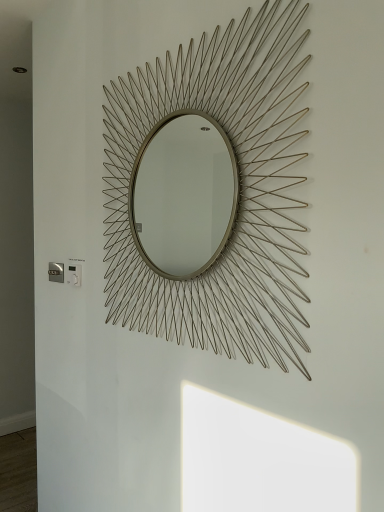
The image size is (384, 512). What do you see at coordinates (56, 272) in the screenshot? I see `metallic silver electric outlet at lower left, which is the 2th electric outlet from front to back` at bounding box center [56, 272].

How much space does metallic silver electric outlet at lower left, positioned as the second electric outlet in right-to-left order, occupy vertically?

metallic silver electric outlet at lower left, positioned as the second electric outlet in right-to-left order, is 3.92 inches in height.

Locate an element on the screen. Image resolution: width=384 pixels, height=512 pixels. gold wire sunburst mirror at center is located at coordinates (234, 194).

Is metallic silver electric outlet at lower left, which is the 2th electric outlet from front to back, situated inside white plastic electric outlet at lower left, which ranks as the second electric outlet in left-to-right order, or outside?

metallic silver electric outlet at lower left, which is the 2th electric outlet from front to back, is spatially situated outside white plastic electric outlet at lower left, which ranks as the second electric outlet in left-to-right order.

Is metallic silver electric outlet at lower left, positioned as the second electric outlet in right-to-left order, facing away from white plastic electric outlet at lower left, marked as the first electric outlet in a front-to-back arrangement?

metallic silver electric outlet at lower left, positioned as the second electric outlet in right-to-left order, is not turned away from white plastic electric outlet at lower left, marked as the first electric outlet in a front-to-back arrangement.

Looking at this image, is metallic silver electric outlet at lower left, which is the first electric outlet in left-to-right order, placed right next to white plastic electric outlet at lower left, which is counted as the 1th electric outlet, starting from the right?

They are not placed beside each other.

Between metallic silver electric outlet at lower left, which appears as the 1th electric outlet when viewed from the back, and white plastic electric outlet at lower left, marked as the first electric outlet in a front-to-back arrangement, which one appears on the right side from the viewer's perspective?

From the viewer's perspective, white plastic electric outlet at lower left, marked as the first electric outlet in a front-to-back arrangement, appears more on the right side.

Considering the points (212, 295) and (70, 284), which point is behind, point (212, 295) or point (70, 284)?

Positioned behind is point (70, 284).

Could you tell me if gold wire sunburst mirror at center is facing white plastic electric outlet at lower left, the 2th electric outlet when ordered from back to front?

No, gold wire sunburst mirror at center is not turned towards white plastic electric outlet at lower left, the 2th electric outlet when ordered from back to front.

Visually, is gold wire sunburst mirror at center positioned to the left or to the right of white plastic electric outlet at lower left, which is counted as the 1th electric outlet, starting from the right?

From the image, it's evident that gold wire sunburst mirror at center is to the right of white plastic electric outlet at lower left, which is counted as the 1th electric outlet, starting from the right.

Considering the sizes of objects gold wire sunburst mirror at center and white plastic electric outlet at lower left, marked as the first electric outlet in a front-to-back arrangement, in the image provided, who is taller, gold wire sunburst mirror at center or white plastic electric outlet at lower left, marked as the first electric outlet in a front-to-back arrangement,?

gold wire sunburst mirror at center is taller.

Considering the positions of points (231, 329) and (49, 262), is point (231, 329) closer to camera compared to point (49, 262)?

Yes.

Locate an element on the screen. mirror above the metallic silver electric outlet at lower left, which is the first electric outlet in left-to-right order (from the image's perspective) is located at coordinates (234, 194).

Can we say gold wire sunburst mirror at center lies outside metallic silver electric outlet at lower left, which is the 2th electric outlet from front to back?

gold wire sunburst mirror at center lies outside metallic silver electric outlet at lower left, which is the 2th electric outlet from front to back,'s area.

Is gold wire sunburst mirror at center not close to metallic silver electric outlet at lower left, which appears as the 1th electric outlet when viewed from the back?

No, there isn't a large distance between gold wire sunburst mirror at center and metallic silver electric outlet at lower left, which appears as the 1th electric outlet when viewed from the back.

Are white plastic electric outlet at lower left, which ranks as the second electric outlet in left-to-right order, and metallic silver electric outlet at lower left, which is the 2th electric outlet from front to back, beside each other?

No, white plastic electric outlet at lower left, which ranks as the second electric outlet in left-to-right order, is not in contact with metallic silver electric outlet at lower left, which is the 2th electric outlet from front to back.

From a real-world perspective, is white plastic electric outlet at lower left, which is counted as the 1th electric outlet, starting from the right, positioned above or below metallic silver electric outlet at lower left, which is the first electric outlet in left-to-right order?

white plastic electric outlet at lower left, which is counted as the 1th electric outlet, starting from the right, is above metallic silver electric outlet at lower left, which is the first electric outlet in left-to-right order.

What are the coordinates of `electric outlet in front of the metallic silver electric outlet at lower left, which appears as the 1th electric outlet when viewed from the back` in the screenshot? It's located at (74, 275).

Is white plastic electric outlet at lower left, marked as the first electric outlet in a front-to-back arrangement, to the left or to the right of metallic silver electric outlet at lower left, which is the first electric outlet in left-to-right order, in the image?

Clearly, white plastic electric outlet at lower left, marked as the first electric outlet in a front-to-back arrangement, is on the right of metallic silver electric outlet at lower left, which is the first electric outlet in left-to-right order, in the image.

Could you measure the distance between white plastic electric outlet at lower left, which ranks as the second electric outlet in left-to-right order, and gold wire sunburst mirror at center?

28.89 inches.

Who is bigger, white plastic electric outlet at lower left, the 2th electric outlet when ordered from back to front, or gold wire sunburst mirror at center?

With larger size is gold wire sunburst mirror at center.

Is white plastic electric outlet at lower left, which is counted as the 1th electric outlet, starting from the right, wider than gold wire sunburst mirror at center?

In fact, white plastic electric outlet at lower left, which is counted as the 1th electric outlet, starting from the right, might be narrower than gold wire sunburst mirror at center.

Considering the positions of objects white plastic electric outlet at lower left, which ranks as the second electric outlet in left-to-right order, and gold wire sunburst mirror at center in the image provided, who is more to the left, white plastic electric outlet at lower left, which ranks as the second electric outlet in left-to-right order, or gold wire sunburst mirror at center?

white plastic electric outlet at lower left, which ranks as the second electric outlet in left-to-right order, is more to the left.

The width and height of the screenshot is (384, 512). I want to click on mirror that appears above the metallic silver electric outlet at lower left, which appears as the 1th electric outlet when viewed from the back (from a real-world perspective), so click(234, 194).

Is metallic silver electric outlet at lower left, which is the 2th electric outlet from front to back, completely or partially outside of gold wire sunburst mirror at center?

That's correct, metallic silver electric outlet at lower left, which is the 2th electric outlet from front to back, is outside of gold wire sunburst mirror at center.

Can you confirm if metallic silver electric outlet at lower left, which is the 2th electric outlet from front to back, is taller than gold wire sunburst mirror at center?

Incorrect, the height of metallic silver electric outlet at lower left, which is the 2th electric outlet from front to back, is not larger of that of gold wire sunburst mirror at center.

Is metallic silver electric outlet at lower left, which is the 2th electric outlet from front to back, positioned far away from gold wire sunburst mirror at center?

No.

What are the coordinates of `electric outlet located behind the white plastic electric outlet at lower left, which is counted as the 1th electric outlet, starting from the right` in the screenshot? It's located at (56, 272).

You are a GUI agent. You are given a task and a screenshot of the screen. Output one action in this format:
    pyautogui.click(x=<x>, y=<y>)
    Task: Click on the 1st electric outlet counting from the left of the gold wire sunburst mirror at center
    
    Given the screenshot: What is the action you would take?
    pyautogui.click(x=74, y=275)

Considering their positions, is white plastic electric outlet at lower left, which ranks as the second electric outlet in left-to-right order, positioned further to gold wire sunburst mirror at center than metallic silver electric outlet at lower left, which is the first electric outlet in left-to-right order?

The object further to gold wire sunburst mirror at center is metallic silver electric outlet at lower left, which is the first electric outlet in left-to-right order.

Which object lies further to the anchor point white plastic electric outlet at lower left, which ranks as the second electric outlet in left-to-right order, gold wire sunburst mirror at center or metallic silver electric outlet at lower left, which is the 2th electric outlet from front to back?

Among the two, gold wire sunburst mirror at center is located further to white plastic electric outlet at lower left, which ranks as the second electric outlet in left-to-right order.

Based on their spatial positions, is metallic silver electric outlet at lower left, which is the 2th electric outlet from front to back, or gold wire sunburst mirror at center further from white plastic electric outlet at lower left, which ranks as the second electric outlet in left-to-right order?

gold wire sunburst mirror at center lies further to white plastic electric outlet at lower left, which ranks as the second electric outlet in left-to-right order, than the other object.

Estimate the real-world distances between objects in this image. Which object is closer to metallic silver electric outlet at lower left, which is the first electric outlet in left-to-right order, gold wire sunburst mirror at center or white plastic electric outlet at lower left, marked as the first electric outlet in a front-to-back arrangement?

white plastic electric outlet at lower left, marked as the first electric outlet in a front-to-back arrangement.

Based on their spatial positions, is white plastic electric outlet at lower left, marked as the first electric outlet in a front-to-back arrangement, or gold wire sunburst mirror at center closer to metallic silver electric outlet at lower left, which appears as the 1th electric outlet when viewed from the back?

Based on the image, white plastic electric outlet at lower left, marked as the first electric outlet in a front-to-back arrangement, appears to be nearer to metallic silver electric outlet at lower left, which appears as the 1th electric outlet when viewed from the back.

Estimate the real-world distances between objects in this image. Which object is closer to gold wire sunburst mirror at center, metallic silver electric outlet at lower left, which appears as the 1th electric outlet when viewed from the back, or white plastic electric outlet at lower left, the 2th electric outlet when ordered from back to front?

white plastic electric outlet at lower left, the 2th electric outlet when ordered from back to front.

This screenshot has height=512, width=384. What are the coordinates of `electric outlet positioned between gold wire sunburst mirror at center and metallic silver electric outlet at lower left, positioned as the second electric outlet in right-to-left order, from near to far` in the screenshot? It's located at (74, 275).